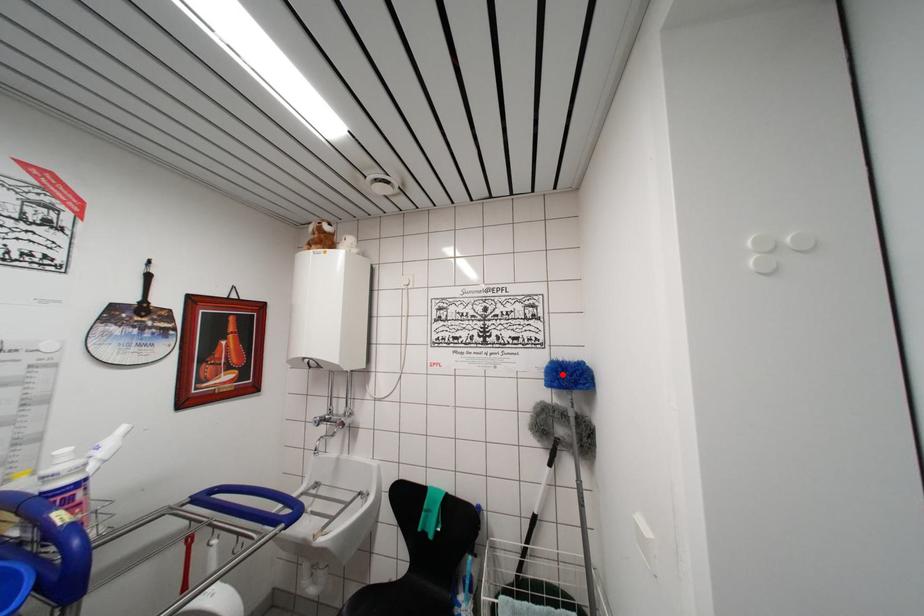
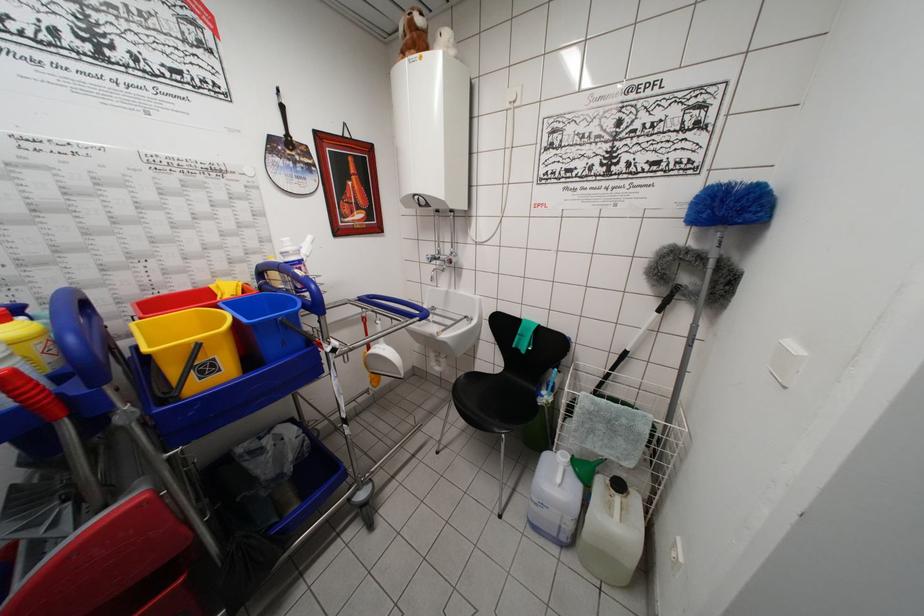
Question: I am providing you with two images of the same scene from different viewpoints. A red point is marked on the first image. Can you still see the location of the red point in image 2?

Choices:
 (A) Yes
 (B) No

Answer: (A)